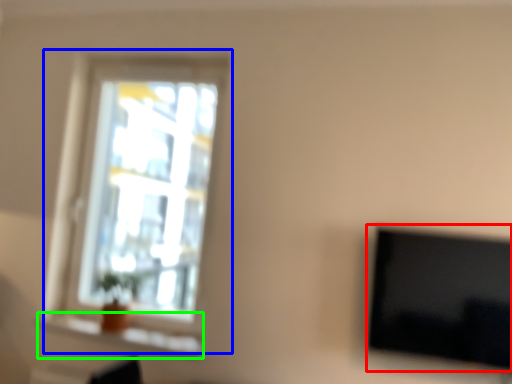
Question: Estimate the real-world distances between objects in this image. Which object is farther from television (highlighted by a red box), window (highlighted by a blue box) or window sill (highlighted by a green box)?

Choices:
 (A) window
 (B) window sill

Answer: (A)